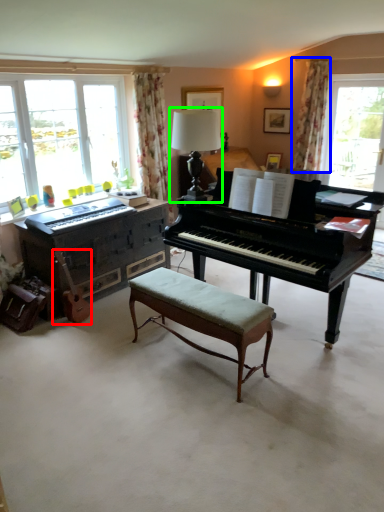
Question: Which object is the closest to the instrument (highlighted by a red box)? Choose among these: curtain (highlighted by a blue box) or table lamp (highlighted by a green box).

Choices:
 (A) curtain
 (B) table lamp

Answer: (B)